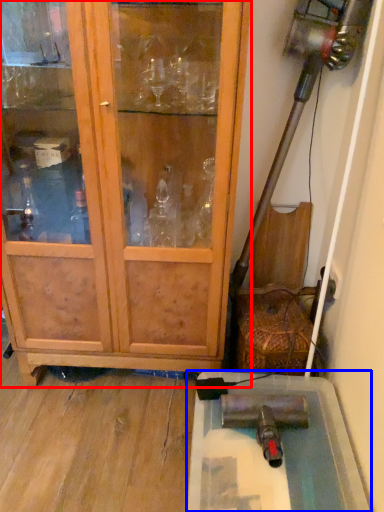
Question: Among these objects, which one is nearest to the camera, cupboard (highlighted by a red box) or cabinetry (highlighted by a blue box)?

Choices:
 (A) cupboard
 (B) cabinetry

Answer: (A)